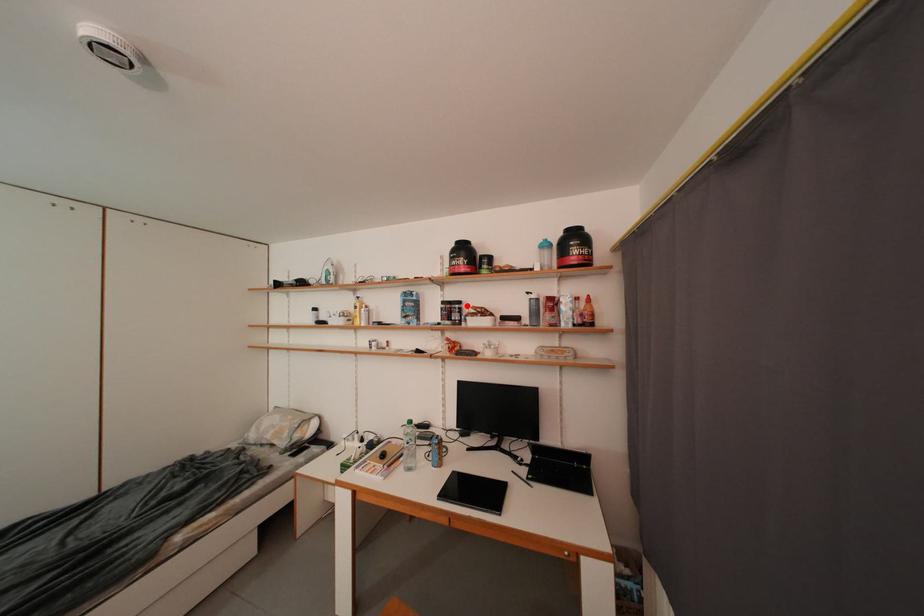
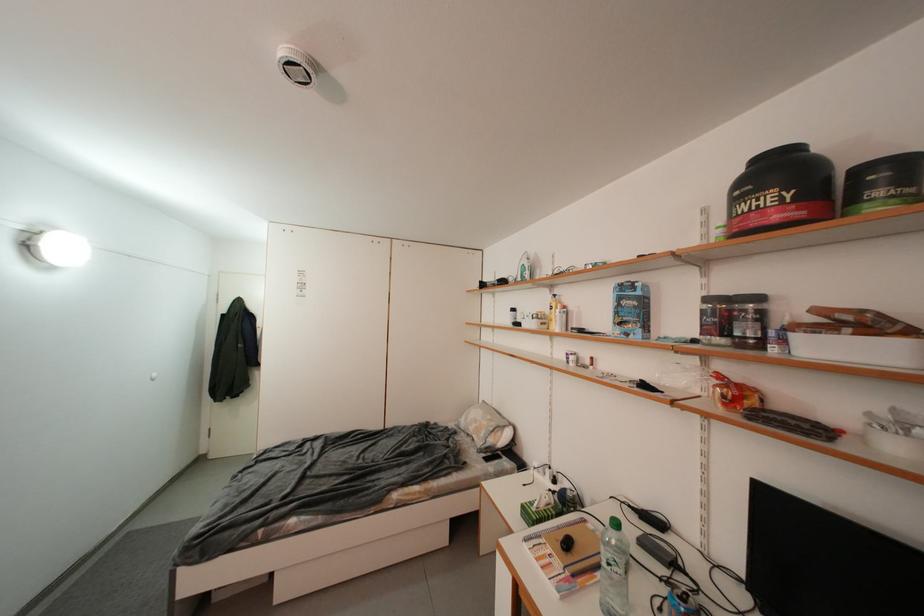
Find the pixel in the second image that matches the highlighted location in the first image.

(766, 301)